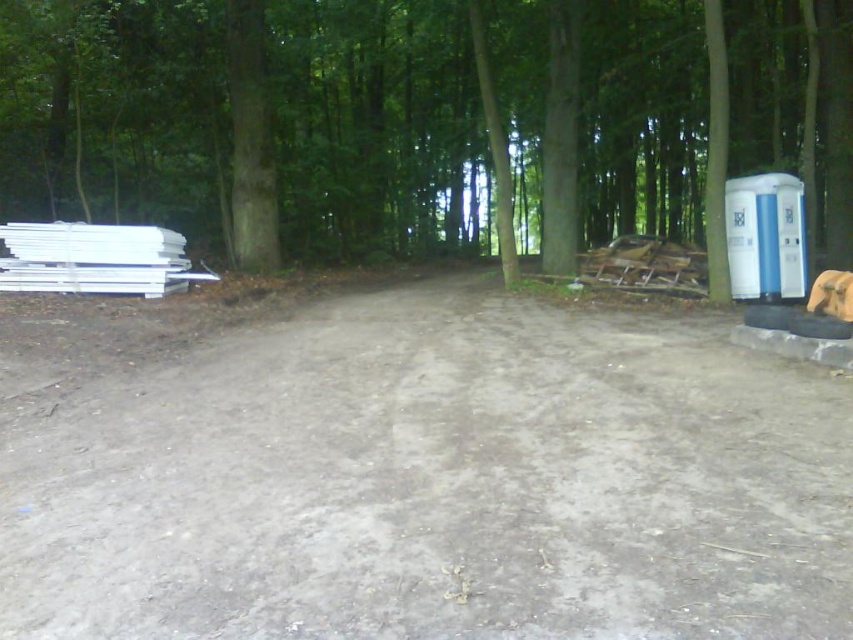
Question: Does gray dirt track at center appear on the left side of white plastic water cooler at right?

Choices:
 (A) no
 (B) yes

Answer: (B)

Question: Among these objects, which one is nearest to the camera?

Choices:
 (A) green smooth tree at left
 (B) gray dirt track at center

Answer: (B)

Question: Among these objects, which one is farthest from the camera?

Choices:
 (A) white plastic water cooler at right
 (B) gray dirt track at center
 (C) green smooth tree at left

Answer: (C)

Question: Can you confirm if gray dirt track at center is positioned above green smooth tree at left?

Choices:
 (A) no
 (B) yes

Answer: (A)

Question: Can you confirm if gray dirt track at center is positioned above white plastic water cooler at right?

Choices:
 (A) yes
 (B) no

Answer: (B)

Question: Among these objects, which one is nearest to the camera?

Choices:
 (A) gray dirt track at center
 (B) white plastic water cooler at right
 (C) green smooth tree at left

Answer: (A)